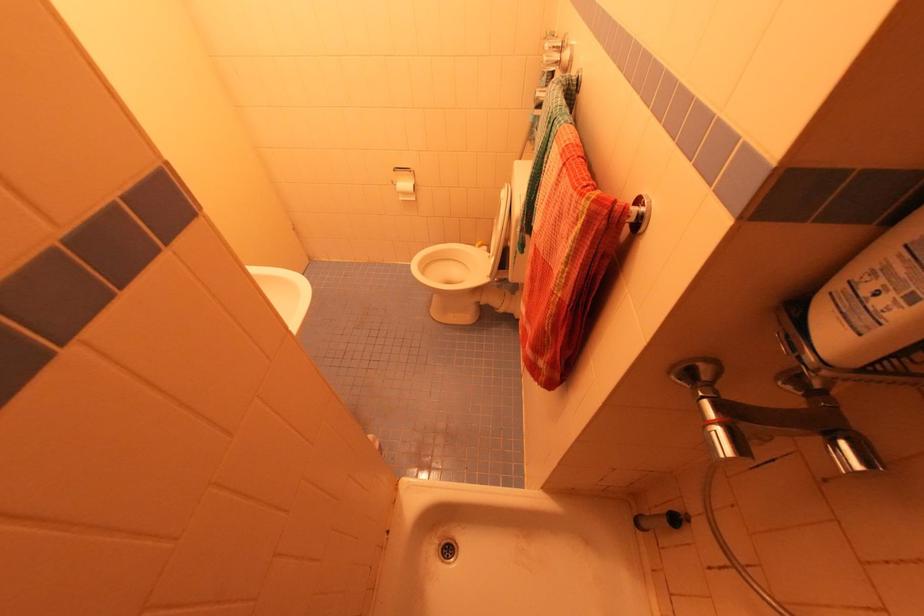
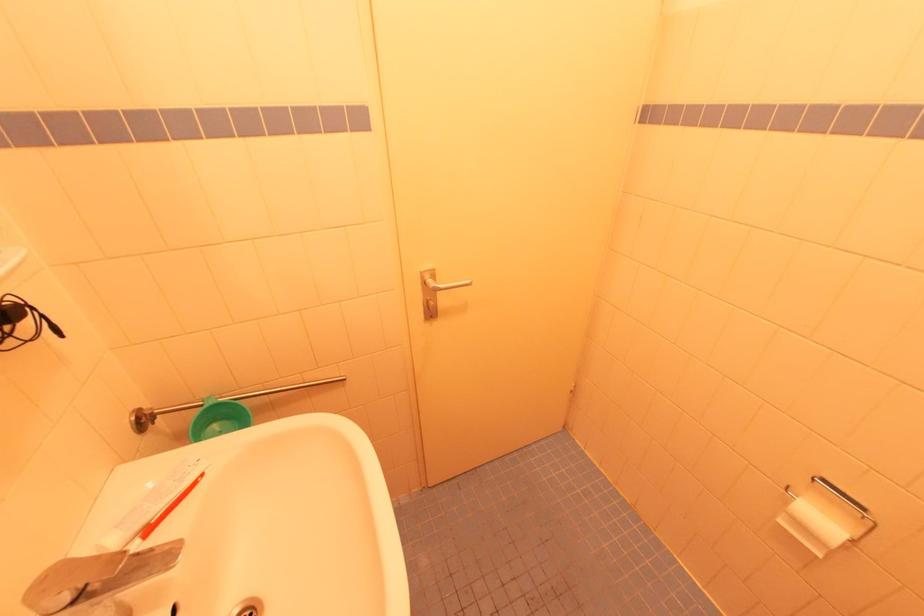
Locate, in the second image, the point that corresponds to point 403,200 in the first image.

(784, 523)